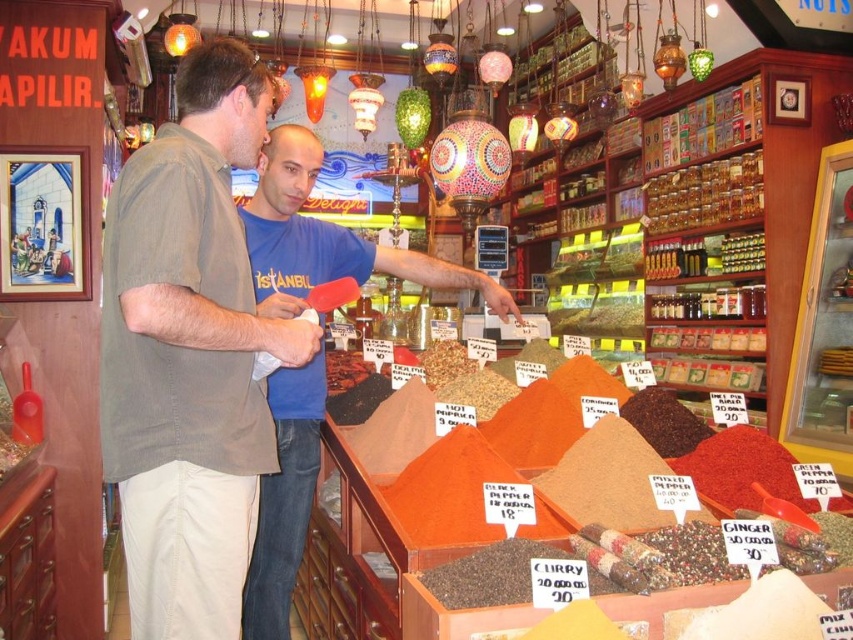
Does point (196, 461) lie in front of point (257, 570)?

Yes, it is.

Can you confirm if light brown cotton shirt at center is shorter than blue t-shirt at center?

Yes, light brown cotton shirt at center is shorter than blue t-shirt at center.

Is point (171, 408) more distant than point (381, 253)?

No, it is not.

This screenshot has height=640, width=853. Identify the location of light brown cotton shirt at center. (190, 353).